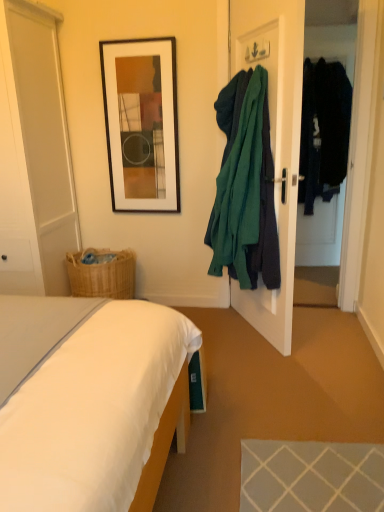
Locate an element on the screen. The width and height of the screenshot is (384, 512). vacant area to the left of teal fabric coat hanger at right is located at coordinates (218, 332).